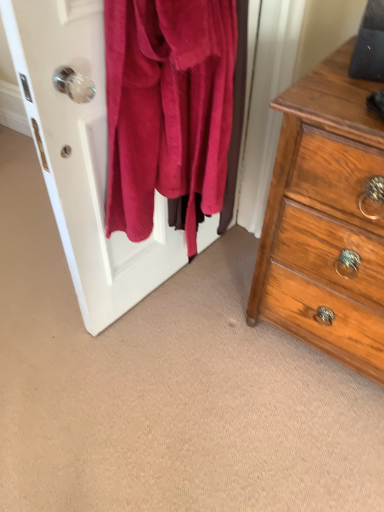
Question: Looking at their shapes, would you say wooden chest of drawers at right is wider or thinner than fuzzy pink sweater at left?

Choices:
 (A) thin
 (B) wide

Answer: (B)

Question: From their relative heights in the image, would you say wooden chest of drawers at right is taller or shorter than fuzzy pink sweater at left?

Choices:
 (A) tall
 (B) short

Answer: (A)

Question: From a real-world perspective, is wooden chest of drawers at right physically located above or below fuzzy pink sweater at left?

Choices:
 (A) above
 (B) below

Answer: (B)

Question: From the image's perspective, is fuzzy pink sweater at left located above or below wooden chest of drawers at right?

Choices:
 (A) below
 (B) above

Answer: (B)

Question: Is fuzzy pink sweater at left situated inside wooden chest of drawers at right or outside?

Choices:
 (A) inside
 (B) outside

Answer: (B)

Question: Is fuzzy pink sweater at left to the left or to the right of wooden chest of drawers at right in the image?

Choices:
 (A) left
 (B) right

Answer: (A)

Question: In terms of height, does fuzzy pink sweater at left look taller or shorter compared to wooden chest of drawers at right?

Choices:
 (A) short
 (B) tall

Answer: (A)